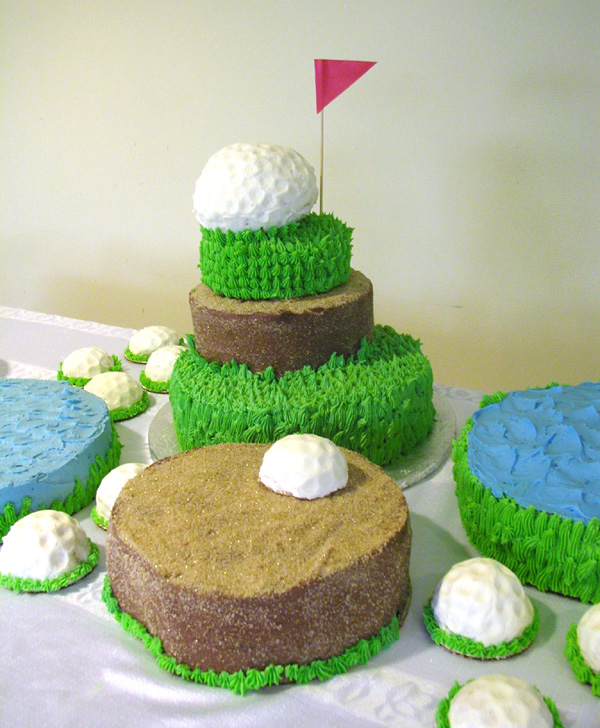
Locate an element on the screen. cake plate is located at coordinates (161, 437).